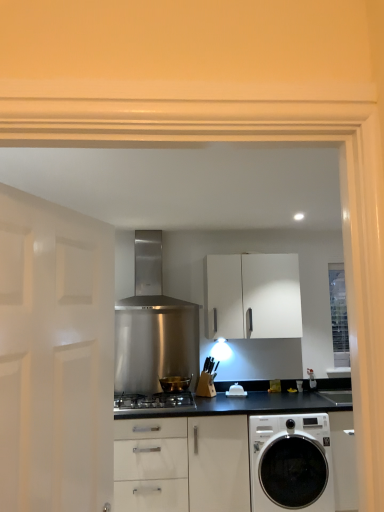
This screenshot has width=384, height=512. What do you see at coordinates (154, 400) in the screenshot?
I see `stainless steel gas stove at center` at bounding box center [154, 400].

Measure the distance between point (x=163, y=395) and camera.

3.52 meters.

Measure the distance between point (342, 290) and camera.

Point (342, 290) and camera are 4.24 meters apart.

The width and height of the screenshot is (384, 512). Find the location of `stainless steel range hood at center`. stainless steel range hood at center is located at coordinates (138, 263).

The height and width of the screenshot is (512, 384). What do you see at coordinates (252, 296) in the screenshot?
I see `white matte cabinet at center` at bounding box center [252, 296].

Describe the element at coordinates (175, 383) in the screenshot. I see `shiny metallic pot at center` at that location.

The height and width of the screenshot is (512, 384). Identify the location of stainless steel gas stove at center. (154, 400).

Considering the relative positions of shiny metallic pot at center and white matte cabinet at center in the image provided, is shiny metallic pot at center to the left or to the right of white matte cabinet at center?

From the image, it's evident that shiny metallic pot at center is to the left of white matte cabinet at center.

In the scene shown: Which object is further away from the camera taking this photo, shiny metallic pot at center or white matte cabinet at center?

Positioned behind is white matte cabinet at center.

From the image's perspective, is shiny metallic pot at center located above white matte cabinet at center?

Incorrect, from the image's perspective, shiny metallic pot at center is lower than white matte cabinet at center.

Is stainless steel range hood at center looking in the opposite direction of white matte door at left?

That's not correct — stainless steel range hood at center is not looking away from white matte door at left.

Can you confirm if stainless steel range hood at center is shorter than white matte door at left?

Correct, stainless steel range hood at center is not as tall as white matte door at left.

Between stainless steel range hood at center and white matte door at left, which one has smaller width?

With smaller width is white matte door at left.

Is stainless steel range hood at center at the right side of white matte door at left?

Indeed, stainless steel range hood at center is positioned on the right side of white matte door at left.

Is the depth of stainless steel range hood at center less than that of white matte cabinet at center?

Yes, stainless steel range hood at center is closer to the camera.

Considering the sizes of objects stainless steel range hood at center and white matte cabinet at center in the image provided, who is shorter, stainless steel range hood at center or white matte cabinet at center?

stainless steel range hood at center is shorter.

Which object is positioned more to the left, stainless steel range hood at center or white matte cabinet at center?

From the viewer's perspective, stainless steel range hood at center appears more on the left side.

Which of these two, white matte door at left or white glossy washing machine at lower right, stands taller?

white matte door at left is taller.

Considering the positions of objects white matte door at left and white glossy washing machine at lower right in the image provided, who is more to the right, white matte door at left or white glossy washing machine at lower right?

Positioned to the right is white glossy washing machine at lower right.

Considering the relative sizes of white matte door at left and white glossy washing machine at lower right in the image provided, is white matte door at left smaller than white glossy washing machine at lower right?

Correct, white matte door at left occupies less space than white glossy washing machine at lower right.

Identify the location of washing machine that appears on the right of white matte door at left. (291, 463).

Is point (346, 310) in front of point (271, 300)?

That is True.

From a real-world perspective, is clear glass window at right positioned above or below white matte cabinet at center?

In terms of real-world spatial position, clear glass window at right is below white matte cabinet at center.

From the image's perspective, which object appears higher, clear glass window at right or white matte cabinet at center?

white matte cabinet at center.

Is clear glass window at right inside shiny metallic pot at center?

That's incorrect, clear glass window at right is not inside shiny metallic pot at center.

Is shiny metallic pot at center at the left side of clear glass window at right?

Yes, shiny metallic pot at center is to the left of clear glass window at right.

Is shiny metallic pot at center in front of or behind clear glass window at right in the image?

In the image, shiny metallic pot at center appears in front of clear glass window at right.

How different are the orientations of shiny metallic pot at center and clear glass window at right in degrees?

They differ by 0.235 degrees in their facing directions.

From a real-world perspective, which is physically above, white matte door at left or stainless steel range hood at center?

In real-world perspective, stainless steel range hood at center is above.

Is white matte door at left inside the boundaries of stainless steel range hood at center, or outside?

white matte door at left is located beyond the bounds of stainless steel range hood at center.

Is stainless steel range hood at center at the back of white matte door at left?

No.

Identify the location of door on the left of stainless steel range hood at center. (55, 356).

Identify the location of cabinetry located on the right of shiny metallic pot at center. The image size is (384, 512). (252, 296).

The image size is (384, 512). I want to click on door on the left side of stainless steel range hood at center, so click(x=55, y=356).

Looking at this image, based on their spatial positions, is white glossy washing machine at lower right or stainless steel gas stove at center closer to stainless steel range hood at center?

stainless steel gas stove at center is positioned closer to the anchor stainless steel range hood at center.

From the image, which object appears to be farther from stainless steel range hood at center, shiny metallic pot at center or white matte door at left?

white matte door at left lies further to stainless steel range hood at center than the other object.

From the image, which object appears to be farther from white matte cabinet at center, clear glass window at right or white matte door at left?

white matte door at left.

Based on their spatial positions, is stainless steel gas stove at center or stainless steel range hood at center closer to shiny metallic pot at center?

stainless steel gas stove at center lies closer to shiny metallic pot at center than the other object.

When comparing their distances from white matte cabinet at center, does white glossy washing machine at lower right or clear glass window at right seem closer?

clear glass window at right is positioned closer to the anchor white matte cabinet at center.

When comparing their distances from stainless steel gas stove at center, does white matte cabinet at center or clear glass window at right seem closer?

Among the two, white matte cabinet at center is located nearer to stainless steel gas stove at center.

Based on their spatial positions, is white matte door at left or shiny metallic pot at center closer to white matte cabinet at center?

The object closer to white matte cabinet at center is shiny metallic pot at center.

Estimate the real-world distances between objects in this image. Which object is closer to shiny metallic pot at center, stainless steel range hood at center or white glossy washing machine at lower right?

The object closer to shiny metallic pot at center is white glossy washing machine at lower right.

What are the coordinates of `gas stove positioned between white matte door at left and stainless steel range hood at center from near to far` in the screenshot? It's located at (154, 400).

In order to click on cabinetry between white matte door at left and clear glass window at right along the z-axis in this screenshot , I will do `click(252, 296)`.

I want to click on washing machine positioned between white matte door at left and clear glass window at right from near to far, so click(x=291, y=463).

Locate an element on the screen. home appliance positioned between white matte door at left and clear glass window at right from near to far is located at coordinates (138, 263).